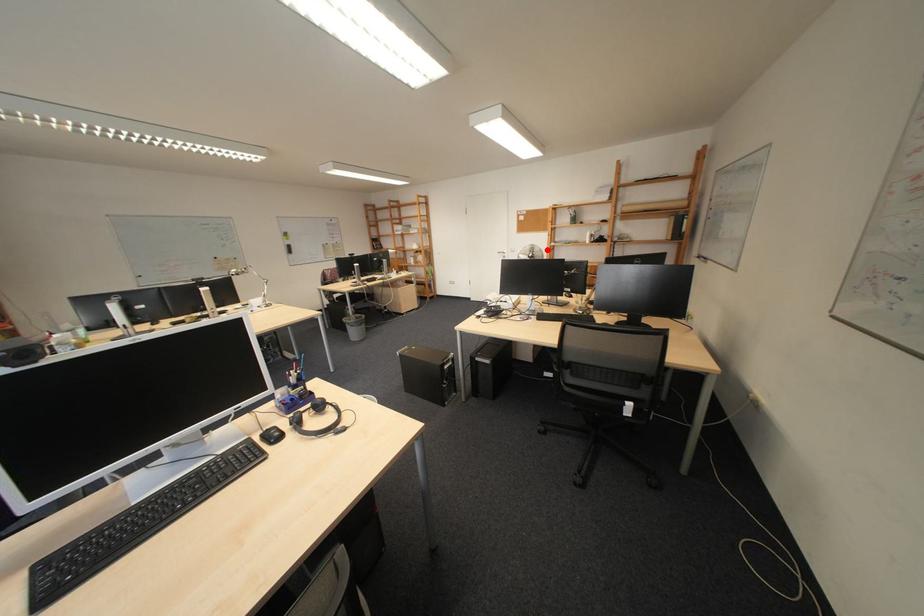
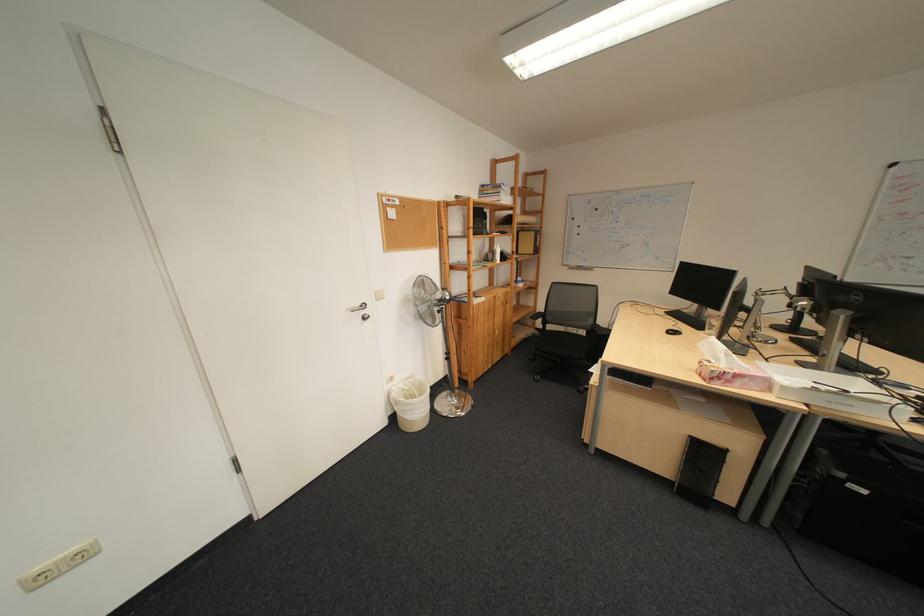
Locate, in the second image, the point that corresponds to the highlighted location in the first image.

(435, 284)